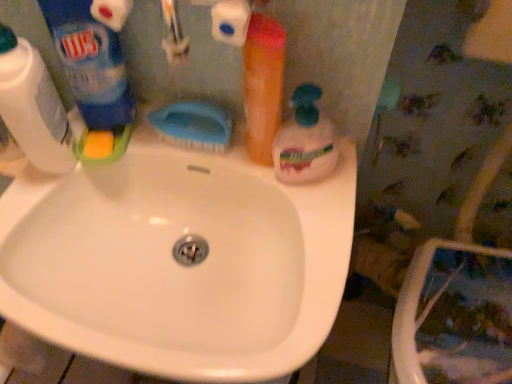
Question: Can you confirm if translucent plastic soap dispenser at center, which is the first cleaning product in right-to-left order, is positioned to the right of blue plastic brush at center?

Choices:
 (A) yes
 (B) no

Answer: (A)

Question: Is translucent plastic soap dispenser at center, which is the first cleaning product in right-to-left order, far away from blue plastic brush at center?

Choices:
 (A) no
 (B) yes

Answer: (A)

Question: Is translucent plastic soap dispenser at center, which is the first cleaning product in right-to-left order, bigger than blue plastic brush at center?

Choices:
 (A) yes
 (B) no

Answer: (A)

Question: Is translucent plastic soap dispenser at center, acting as the 4th cleaning product starting from the left, at the left side of blue plastic brush at center?

Choices:
 (A) no
 (B) yes

Answer: (A)

Question: Could you tell me if translucent plastic soap dispenser at center, which is the first cleaning product in right-to-left order, is facing blue plastic brush at center?

Choices:
 (A) yes
 (B) no

Answer: (B)

Question: From the image's perspective, is translucent plastic soap dispenser at center, acting as the 4th cleaning product starting from the left, beneath blue plastic brush at center?

Choices:
 (A) yes
 (B) no

Answer: (A)

Question: Considering the relative sizes of white glossy sink at center and translucent plastic soap dispenser at center, which is the first cleaning product in right-to-left order, in the image provided, is white glossy sink at center thinner than translucent plastic soap dispenser at center, which is the first cleaning product in right-to-left order,?

Choices:
 (A) no
 (B) yes

Answer: (A)

Question: Can you confirm if white glossy sink at center is taller than translucent plastic soap dispenser at center, acting as the 4th cleaning product starting from the left?

Choices:
 (A) no
 (B) yes

Answer: (B)

Question: From a real-world perspective, is white glossy sink at center under translucent plastic soap dispenser at center, which is the first cleaning product in right-to-left order?

Choices:
 (A) yes
 (B) no

Answer: (A)

Question: From a real-world perspective, is white glossy sink at center physically above translucent plastic soap dispenser at center, acting as the 4th cleaning product starting from the left?

Choices:
 (A) no
 (B) yes

Answer: (A)

Question: Is white glossy sink at center positioned beyond the bounds of translucent plastic soap dispenser at center, which is the first cleaning product in right-to-left order?

Choices:
 (A) no
 (B) yes

Answer: (B)

Question: Is the position of white glossy sink at center more distant than that of translucent plastic soap dispenser at center, which is the first cleaning product in right-to-left order?

Choices:
 (A) no
 (B) yes

Answer: (A)

Question: Could you tell me if translucent orange bottle at upper right, marked as the 3th cleaning product in a left-to-right arrangement, is facing white plastic bottle at left, which is the first cleaning product in left-to-right order?

Choices:
 (A) no
 (B) yes

Answer: (A)